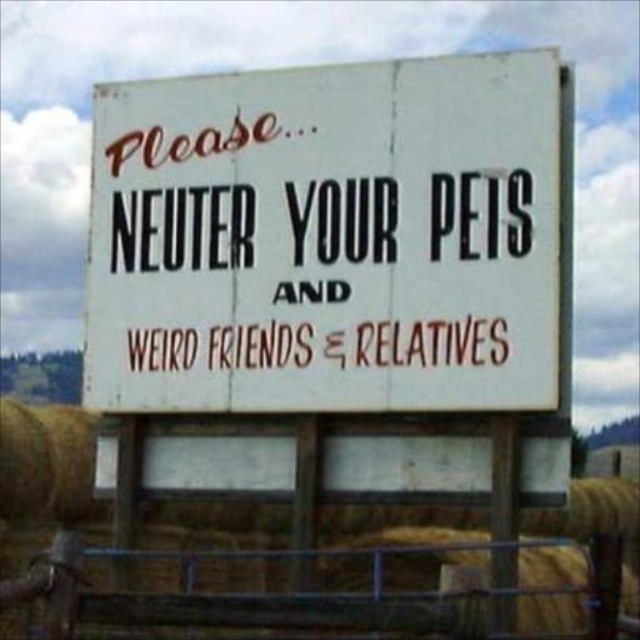
You are a hiker who just arrived at the scene. You see the white paper sign at center and the metal wire fence at lower center. Which object is positioned higher in the image?

The white paper sign at center is located above the metal wire fence at lower center, so it is positioned higher in the image.

You are a surveyor measuring distances between objects in a rural area. You have a measuring tape that can only extend up to 7 meters. You need to measure the distance between the white paper sign at center and the metal wire fence at lower center. Can your measuring tape reach that distance?

The white paper sign at center is 7.46 meters away from the metal wire fence at lower center. Since the measuring tape can only extend up to 7 meters, it cannot reach the full distance between the white paper sign at center and the metal wire fence at lower center.

You are a painter standing in front of the white paper sign at center and the metal wire fence at lower center. You want to paint the closest object first. Which object should you paint first?

The white paper sign at center is closer to you than the metal wire fence at lower center, so you should paint the white paper sign at center first.